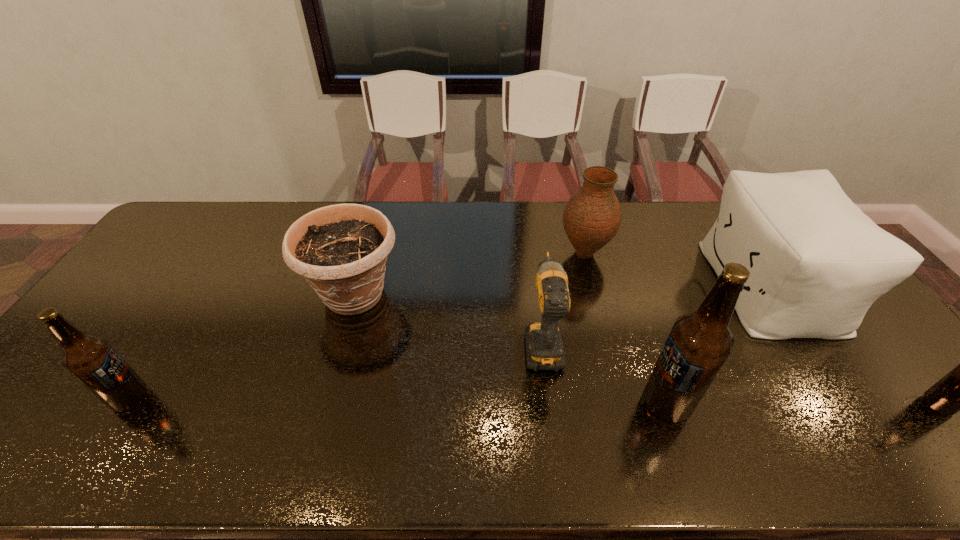
You are a GUI agent. You are given a task and a screenshot of the screen. Output one action in this format:
    pyautogui.click(x=<x>, y=<y>)
    Task: Click on the vacant area that lies between the leftmost object and the cushion
    The width and height of the screenshot is (960, 540).
    Given the screenshot: What is the action you would take?
    pyautogui.click(x=449, y=342)

This screenshot has width=960, height=540. In order to click on free spot between the fifth object from right to left and the flowerpot in this screenshot , I will do `click(448, 318)`.

Where is `blank region between the leftmost beer bottle and the tallest object`? The width and height of the screenshot is (960, 540). blank region between the leftmost beer bottle and the tallest object is located at coordinates (398, 401).

Identify which object is located as the second nearest to the leftmost beer bottle. Please provide its 2D coordinates. Your answer should be formatted as a tuple, i.e. [(x, y)], where the tuple contains the x and y coordinates of a point satisfying the conditions above.

[(544, 347)]

This screenshot has height=540, width=960. What are the coordinates of `the sixth closest object to the shortest beer bottle` in the screenshot? It's located at (92, 360).

Select which beer bottle is the second closest to the shortest beer bottle. Please provide its 2D coordinates. Your answer should be formatted as a tuple, i.e. [(x, y)], where the tuple contains the x and y coordinates of a point satisfying the conditions above.

[(92, 360)]

Where is `beer bottle object that ranks as the closest to the leftmost beer bottle`? beer bottle object that ranks as the closest to the leftmost beer bottle is located at coordinates (699, 343).